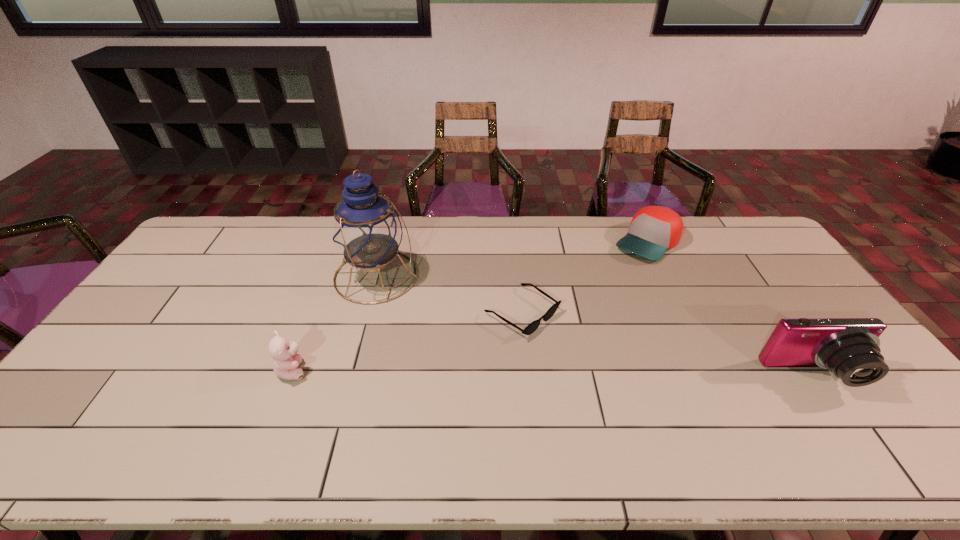
Locate an element on the screen. Image resolution: width=960 pixels, height=540 pixels. teddy bear is located at coordinates (286, 359).

You are a GUI agent. You are given a task and a screenshot of the screen. Output one action in this format:
    pyautogui.click(x=<x>, y=<y>)
    Task: Click on the rightmost object
    Image resolution: width=960 pixels, height=540 pixels.
    Given the screenshot: What is the action you would take?
    [849, 347]

Locate an element on the screen. The width and height of the screenshot is (960, 540). camera is located at coordinates (849, 347).

Where is `sunglasses`? Image resolution: width=960 pixels, height=540 pixels. sunglasses is located at coordinates (534, 325).

Locate an element on the screen. The height and width of the screenshot is (540, 960). the third object from left to right is located at coordinates tap(534, 325).

Find the location of `baseball cap`. baseball cap is located at coordinates (654, 229).

Locate an element on the screen. This screenshot has height=540, width=960. the tallest object is located at coordinates (367, 230).

Find the location of a particular element. free space located 0.220m at the face of the teddy bear is located at coordinates (391, 370).

The width and height of the screenshot is (960, 540). I want to click on free point located on the front-facing side of the shortest object, so click(x=663, y=406).

Find the location of `free spot located 0.290m on the front-facing side of the shortest object`. free spot located 0.290m on the front-facing side of the shortest object is located at coordinates (645, 394).